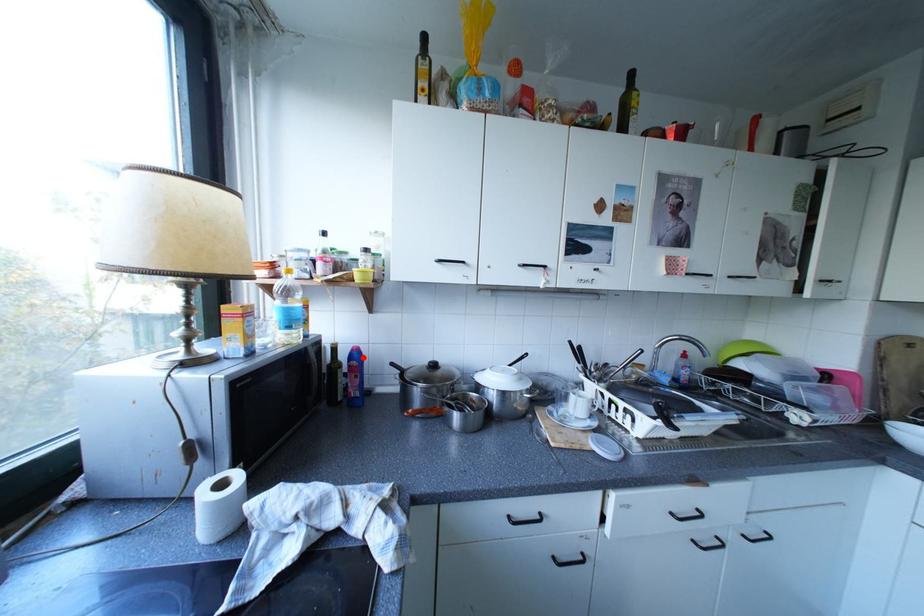
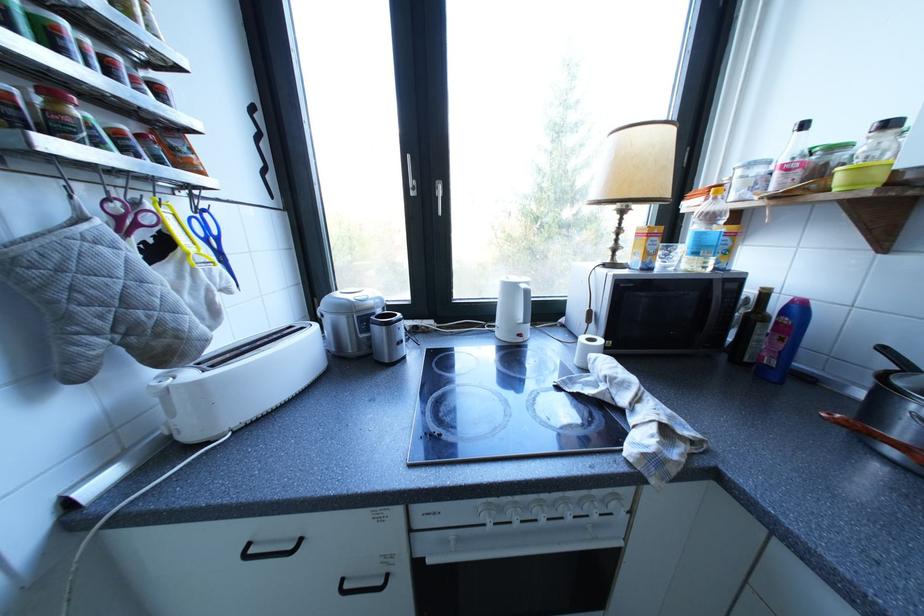
Find the pixel in the second image that matches the highlighted location in the first image.

(797, 312)